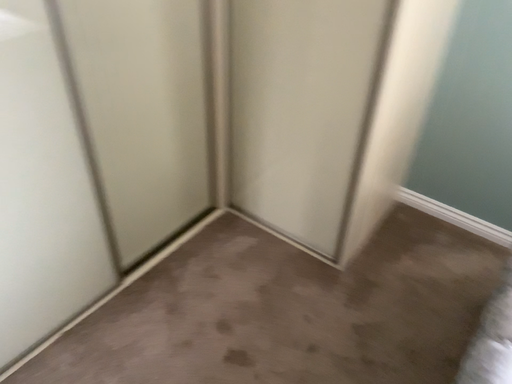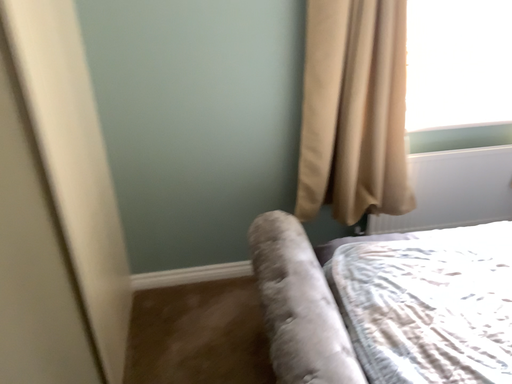
Question: Which way did the camera rotate in the video?

Choices:
 (A) rotated right
 (B) rotated left

Answer: (A)